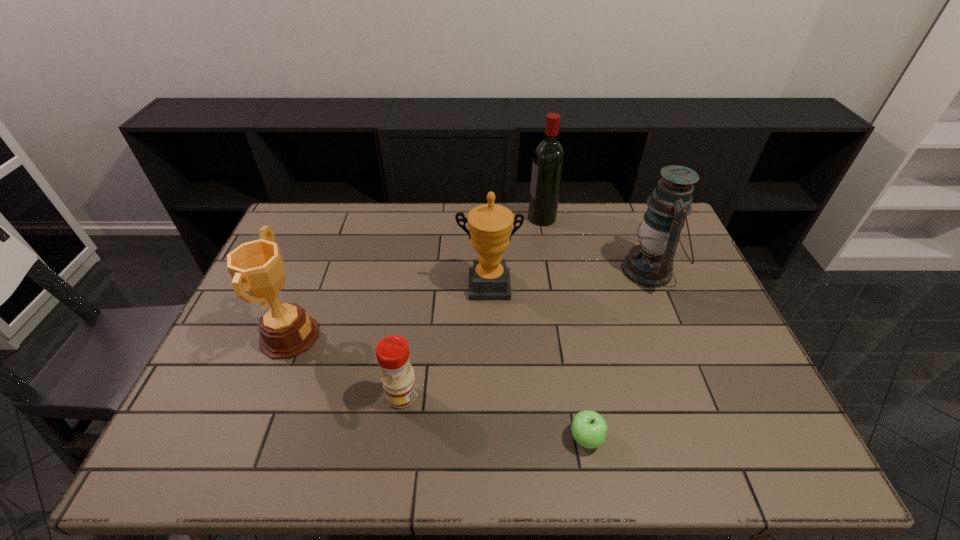
Where is `unoccupied area between the third nearest object and the shortest object`? unoccupied area between the third nearest object and the shortest object is located at coordinates (438, 387).

I want to click on unoccupied area between the fifth tallest object and the wine bottle, so click(472, 307).

Identify the location of free space between the apple and the condiment. (494, 417).

Identify the location of vacant space that is in between the leftmost object and the farthest object. (416, 277).

Locate an element on the screen. The image size is (960, 540). free space between the wine bottle and the oil lamp is located at coordinates (595, 244).

Find the location of a particular element. This screenshot has height=540, width=960. vacant area that lies between the rightmost object and the shortest object is located at coordinates (617, 354).

Locate which object ranks fourth in proximity to the farthest object. Please provide its 2D coordinates. Your answer should be formatted as a tuple, i.e. [(x, y)], where the tuple contains the x and y coordinates of a point satisfying the conditions above.

[(286, 330)]

Identify which object is the fifth nearest to the oil lamp. Please provide its 2D coordinates. Your answer should be formatted as a tuple, i.e. [(x, y)], where the tuple contains the x and y coordinates of a point satisfying the conditions above.

[(286, 330)]

Where is `free spot that satisfies the following two spatial constraints: 1. on the front-facing side of the condiment; 2. on the left side of the third nearest object`? free spot that satisfies the following two spatial constraints: 1. on the front-facing side of the condiment; 2. on the left side of the third nearest object is located at coordinates (267, 395).

Locate an element on the screen. The image size is (960, 540). vacant space that satisfies the following two spatial constraints: 1. on the label of the wine bottle; 2. on the back side of the oil lamp is located at coordinates (x=551, y=271).